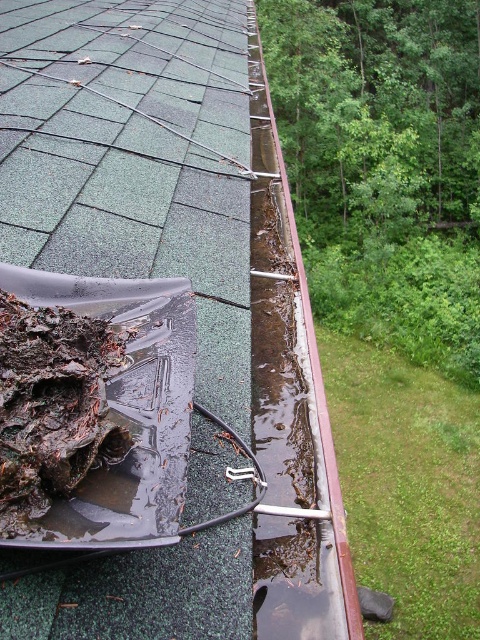
Question: Does green shingles at upper left appear on the right side of brown organic matter at lower left?

Choices:
 (A) no
 (B) yes

Answer: (A)

Question: From the image, what is the correct spatial relationship of green shingles at upper left in relation to brown organic matter at lower left?

Choices:
 (A) left
 (B) right

Answer: (A)

Question: Among these objects, which one is farthest from the camera?

Choices:
 (A) green shingles at upper left
 (B) brown organic matter at lower left

Answer: (A)

Question: Is green shingles at upper left below brown organic matter at lower left?

Choices:
 (A) no
 (B) yes

Answer: (A)

Question: Which point is closer to the camera taking this photo?

Choices:
 (A) (67, 449)
 (B) (27, 138)

Answer: (A)